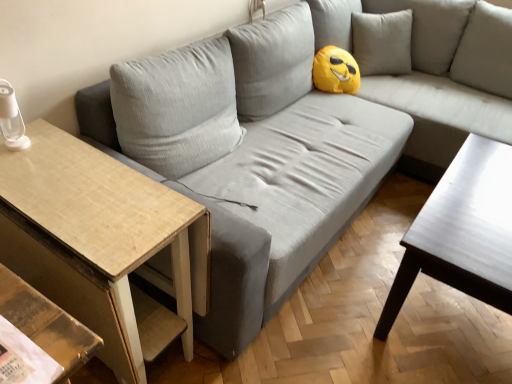
Find the location of a particular element. This screenshot has width=512, height=384. vacant space situated on the left part of shiny dark wood coffee table at right is located at coordinates (344, 301).